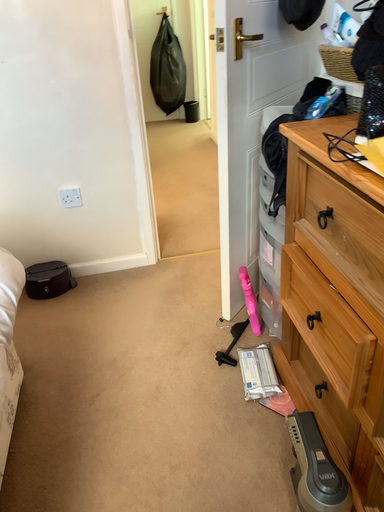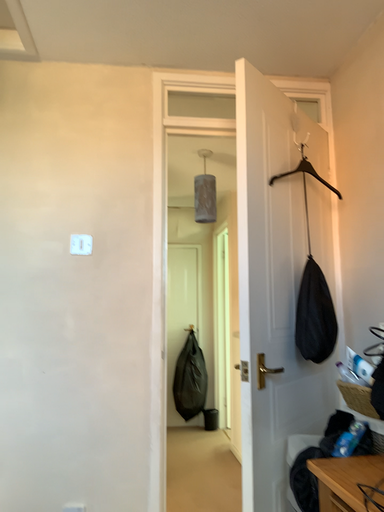
Question: Which way did the camera rotate in the video?

Choices:
 (A) rotated downward
 (B) rotated upward

Answer: (B)